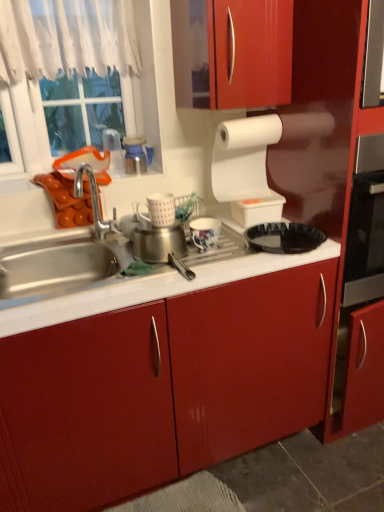
This screenshot has width=384, height=512. Describe the element at coordinates (205, 232) in the screenshot. I see `porcelain floral mug at center, the 2th appliance when ordered from right to left` at that location.

This screenshot has width=384, height=512. I want to click on white matte paper towel at upper right, so click(243, 157).

Locate an element on the screen. black plastic tray at center is located at coordinates (284, 238).

What do you see at coordinates (160, 209) in the screenshot? The image size is (384, 512). I see `white glossy mug at center, arranged as the second appliance when viewed from the left` at bounding box center [160, 209].

The width and height of the screenshot is (384, 512). Describe the element at coordinates (66, 38) in the screenshot. I see `white sheer curtain at upper left` at that location.

Identify the location of white plastic container at upper center, marked as the first appliance in a right-to-left arrangement. (258, 209).

Where is `white lace curtain at upper left`? This screenshot has width=384, height=512. white lace curtain at upper left is located at coordinates (81, 109).

What do you see at coordinates (81, 109) in the screenshot?
I see `white lace curtain at upper left` at bounding box center [81, 109].

Locate an element on the screen. This screenshot has height=512, width=384. porcelain floral mug at center, arranged as the 3th appliance when viewed from the left is located at coordinates (205, 232).

At what (x,y) coordinates should I click in order to perform the action: click on kitchen appliance in front of the white sheer curtain at upper left. Please return your answer as a coordinate pair (x, y). The height and width of the screenshot is (512, 384). Looking at the image, I should click on (284, 238).

Considering the relative sizes of white sheer curtain at upper left and black plastic tray at center in the image provided, is white sheer curtain at upper left wider than black plastic tray at center?

In fact, white sheer curtain at upper left might be narrower than black plastic tray at center.

Between white sheer curtain at upper left and black plastic tray at center, which one appears on the right side from the viewer's perspective?

black plastic tray at center.

Is white sheer curtain at upper left smaller than black plastic tray at center?

Actually, white sheer curtain at upper left might be larger than black plastic tray at center.

From the image's perspective, which object appears higher, white sheer curtain at upper left or porcelain floral mug at center, the 2th appliance when ordered from right to left?

From the image's view, white sheer curtain at upper left is above.

Is white sheer curtain at upper left far away from porcelain floral mug at center, arranged as the 3th appliance when viewed from the left?

Actually, white sheer curtain at upper left and porcelain floral mug at center, arranged as the 3th appliance when viewed from the left, are a little close together.

From a real-world perspective, relative to porcelain floral mug at center, arranged as the 3th appliance when viewed from the left, is white sheer curtain at upper left vertically above or below?

white sheer curtain at upper left is situated higher than porcelain floral mug at center, arranged as the 3th appliance when viewed from the left, in the real world.

Could you tell me if white sheer curtain at upper left is facing porcelain floral mug at center, arranged as the 3th appliance when viewed from the left?

No.

Is white matte paper towel at upper right with white plastic container at upper center, marked as the first appliance in a right-to-left arrangement?

No, white matte paper towel at upper right is not in contact with white plastic container at upper center, marked as the first appliance in a right-to-left arrangement.

Based on the photo, which object is further away from the camera, white matte paper towel at upper right or white plastic container at upper center, positioned as the 4th appliance in left-to-right order?

white plastic container at upper center, positioned as the 4th appliance in left-to-right order, is further from the camera.

Considering the points (217, 157) and (243, 220), which point is in front, point (217, 157) or point (243, 220)?

Positioned in front is point (243, 220).

Considering the sizes of white matte paper towel at upper right and white plastic container at upper center, positioned as the 4th appliance in left-to-right order, in the image, is white matte paper towel at upper right taller or shorter than white plastic container at upper center, positioned as the 4th appliance in left-to-right order,?

Clearly, white matte paper towel at upper right is taller compared to white plastic container at upper center, positioned as the 4th appliance in left-to-right order.

Is point (132, 9) more distant than point (297, 243)?

Yes, it is.

Where is `kitchen appliance below the white lace curtain at upper left (from a real-world perspective)`? The width and height of the screenshot is (384, 512). kitchen appliance below the white lace curtain at upper left (from a real-world perspective) is located at coordinates (284, 238).

Is white lace curtain at upper left turned away from black plastic tray at center?

No, black plastic tray at center is not at the back of white lace curtain at upper left.

Relative to white lace curtain at upper left, is black plastic tray at center in front or behind?

black plastic tray at center is positioned closer to the viewer than white lace curtain at upper left.

Considering the relative sizes of black plastic tray at center and white lace curtain at upper left in the image provided, is black plastic tray at center taller than white lace curtain at upper left?

No.

Is point (258, 240) in front of point (131, 87)?

Yes, it is.

Between black plastic tray at center and white lace curtain at upper left, which one appears on the left side from the viewer's perspective?

Positioned to the left is white lace curtain at upper left.

Considering the sizes of objects white lace curtain at upper left and white plastic container at upper center, marked as the first appliance in a right-to-left arrangement, in the image provided, who is wider, white lace curtain at upper left or white plastic container at upper center, marked as the first appliance in a right-to-left arrangement,?

With larger width is white plastic container at upper center, marked as the first appliance in a right-to-left arrangement.

Is white lace curtain at upper left completely or partially outside of white plastic container at upper center, positioned as the 4th appliance in left-to-right order?

Yes, white lace curtain at upper left is not within white plastic container at upper center, positioned as the 4th appliance in left-to-right order.

Considering the relative positions of white lace curtain at upper left and white plastic container at upper center, positioned as the 4th appliance in left-to-right order, in the image provided, is white lace curtain at upper left to the right of white plastic container at upper center, positioned as the 4th appliance in left-to-right order, from the viewer's perspective?

In fact, white lace curtain at upper left is to the left of white plastic container at upper center, positioned as the 4th appliance in left-to-right order.

Is white lace curtain at upper left touching white plastic container at upper center, positioned as the 4th appliance in left-to-right order?

No.

Is white glossy mug at center, arranged as the second appliance when viewed from the left, aimed at white matte paper towel at upper right?

No, white glossy mug at center, arranged as the second appliance when viewed from the left, is not oriented towards white matte paper towel at upper right.

From the image's perspective, relative to white matte paper towel at upper right, is white glossy mug at center, arranged as the second appliance when viewed from the left, above or below?

white glossy mug at center, arranged as the second appliance when viewed from the left, is below white matte paper towel at upper right.

Locate an element on the screen. The image size is (384, 512). paper towel that appears above the white glossy mug at center, arranged as the 3th appliance when viewed from the right (from a real-world perspective) is located at coordinates (243, 157).

Is white glossy mug at center, arranged as the 3th appliance when viewed from the right, wider or thinner than white matte paper towel at upper right?

In the image, white glossy mug at center, arranged as the 3th appliance when viewed from the right, appears to be more narrow than white matte paper towel at upper right.

This screenshot has height=512, width=384. I want to click on kitchen appliance below the white sheer curtain at upper left (from the image's perspective), so click(284, 238).

Where is `curtain that appears on the left of porcelain floral mug at center, the 2th appliance when ordered from right to left`? Image resolution: width=384 pixels, height=512 pixels. curtain that appears on the left of porcelain floral mug at center, the 2th appliance when ordered from right to left is located at coordinates (66, 38).

Estimate the real-world distances between objects in this image. Which object is closer to white sheer curtain at upper left, porcelain floral mug at center, arranged as the 3th appliance when viewed from the left, or black plastic tray at center?

porcelain floral mug at center, arranged as the 3th appliance when viewed from the left, is closer to white sheer curtain at upper left.

Considering their positions, is white lace curtain at upper left positioned closer to white matte paper towel at upper right than porcelain floral mug at center, arranged as the 3th appliance when viewed from the left?

porcelain floral mug at center, arranged as the 3th appliance when viewed from the left.

When comparing their distances from porcelain floral mug at center, the 2th appliance when ordered from right to left, does white lace curtain at upper left or black plastic tray at center seem further?

white lace curtain at upper left lies further to porcelain floral mug at center, the 2th appliance when ordered from right to left, than the other object.

From the image, which object appears to be farther from white plastic container at upper center, positioned as the 4th appliance in left-to-right order, porcelain floral mug at center, arranged as the 3th appliance when viewed from the left, or white matte paper towel at upper right?

Among the two, porcelain floral mug at center, arranged as the 3th appliance when viewed from the left, is located further to white plastic container at upper center, positioned as the 4th appliance in left-to-right order.

Looking at this image, considering their positions, is brushed metal canister at upper center, arranged as the fourth appliance when viewed from the right, positioned further to porcelain floral mug at center, arranged as the 3th appliance when viewed from the left, than white lace curtain at upper left?

The object further to porcelain floral mug at center, arranged as the 3th appliance when viewed from the left, is white lace curtain at upper left.

Which object lies further to the anchor point brushed metal canister at upper center, arranged as the fourth appliance when viewed from the right, white glossy mug at center, arranged as the 3th appliance when viewed from the right, or black plastic tray at center?

The object further to brushed metal canister at upper center, arranged as the fourth appliance when viewed from the right, is black plastic tray at center.

Estimate the real-world distances between objects in this image. Which object is closer to black plastic tray at center, white matte paper towel at upper right or white glossy mug at center, arranged as the 3th appliance when viewed from the right?

Based on the image, white matte paper towel at upper right appears to be nearer to black plastic tray at center.

Estimate the real-world distances between objects in this image. Which object is closer to black plastic tray at center, white lace curtain at upper left or white sheer curtain at upper left?

white lace curtain at upper left.

This screenshot has height=512, width=384. What are the coordinates of `appliance between white glossy mug at center, arranged as the 3th appliance when viewed from the right, and white plastic container at upper center, marked as the first appliance in a right-to-left arrangement, in the horizontal direction` in the screenshot? It's located at (205, 232).

The image size is (384, 512). Find the location of `paper towel between white sheer curtain at upper left and white plastic container at upper center, marked as the first appliance in a right-to-left arrangement, from left to right`. paper towel between white sheer curtain at upper left and white plastic container at upper center, marked as the first appliance in a right-to-left arrangement, from left to right is located at coordinates (243, 157).

Locate an element on the screen. The width and height of the screenshot is (384, 512). paper towel between white lace curtain at upper left and black plastic tray at center is located at coordinates (243, 157).

I want to click on curtain between white lace curtain at upper left and white matte paper towel at upper right in the horizontal direction, so click(x=66, y=38).